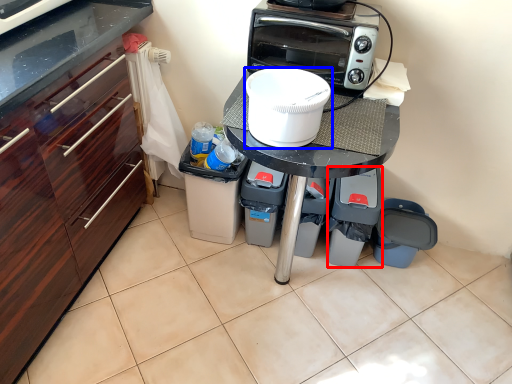
Question: Which point is closer to the camera, appliance (highlighted by a red box) or home appliance (highlighted by a blue box)?

Choices:
 (A) appliance
 (B) home appliance

Answer: (B)